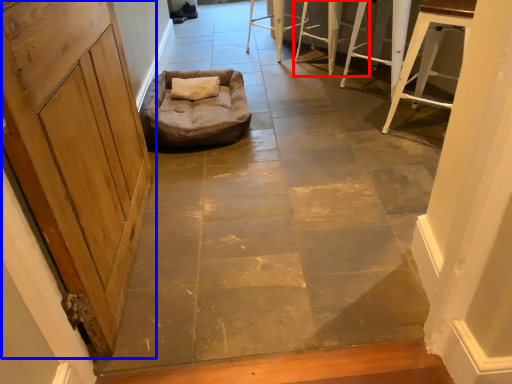
Question: Which object is closer to the camera taking this photo, furniture (highlighted by a red box) or door (highlighted by a blue box)?

Choices:
 (A) furniture
 (B) door

Answer: (B)